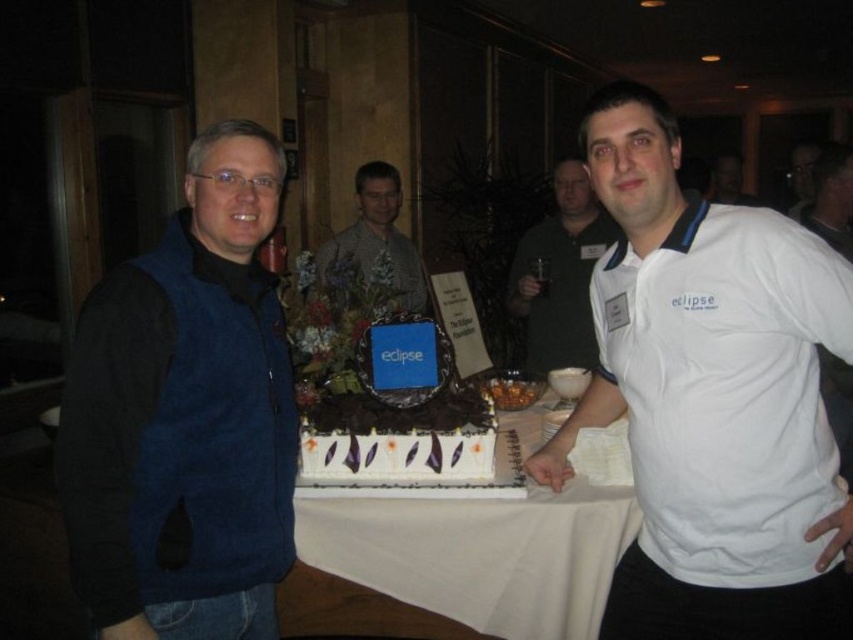
Question: Which point is farther to the camera?

Choices:
 (A) (399, 250)
 (B) (723, 157)
 (C) (793, 202)
 (D) (730, 538)

Answer: (C)

Question: Can you confirm if white cloth at center is thinner than matte white shirt at center?

Choices:
 (A) no
 (B) yes

Answer: (A)

Question: Among these objects, which one is nearest to the camera?

Choices:
 (A) patterned fabric shirt at center
 (B) white cotton shirt at center
 (C) chocolatesmoothcake at center
 (D) blue fleece vest at left

Answer: (D)

Question: Does white cotton shirt at center appear on the left side of white cotton polo shirt at center?

Choices:
 (A) no
 (B) yes

Answer: (B)

Question: Can you confirm if white cotton polo shirt at center is positioned above matte white shirt at center?

Choices:
 (A) no
 (B) yes

Answer: (A)

Question: Which point is farther from the camera taking this photo?

Choices:
 (A) (416, 304)
 (B) (788, 476)
 (C) (315, 470)

Answer: (A)